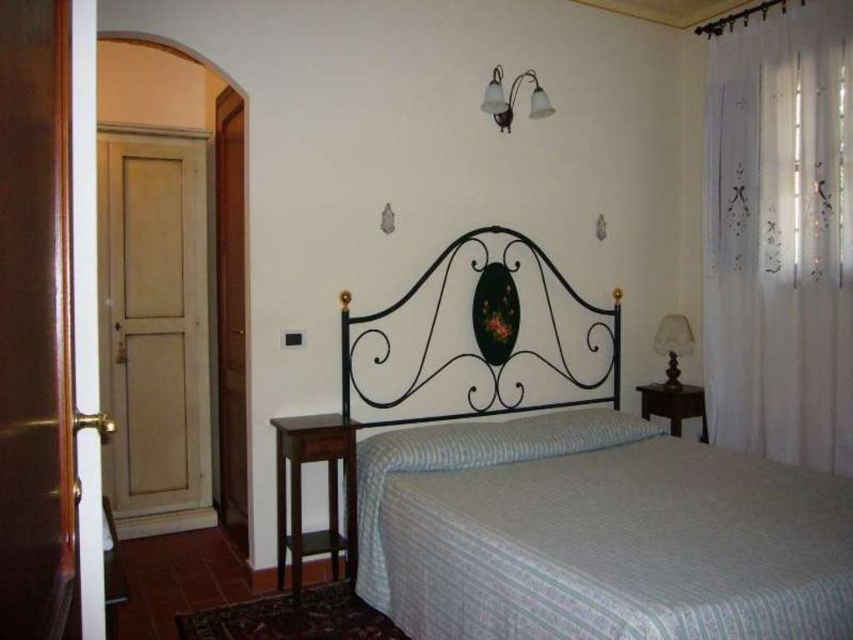
You are standing in the center of the bedroom and notice a point marked at coordinates [566,483]. Based on the scene description, what object does this point correspond to?

The point at coordinates [566,483] corresponds to the white striped fabric bed at center, as indicated by the objects description.

You are standing in the bedroom and want to hang a new picture frame on the wall. The frame is 1 meter tall and needs to be placed above the white striped fabric bed at center without overlapping the white sheer curtain at right. Is there enough space between the bed and the curtain to place the frame?

The white striped fabric bed at center is located below the white sheer curtain at right, so there is space between them. Since the frame is 1 meter tall, you can place it between the white striped fabric bed at center and the white sheer curtain at right without overlapping.